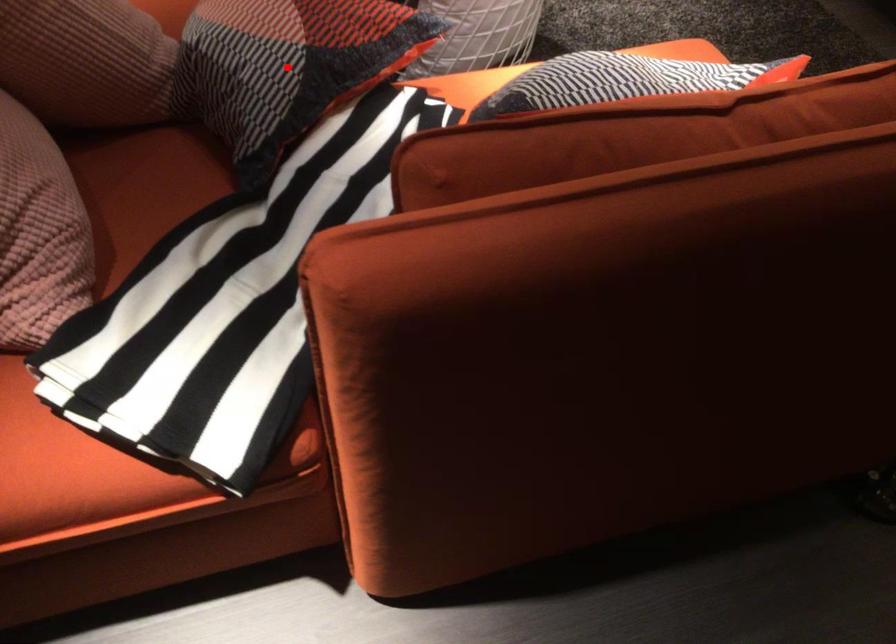
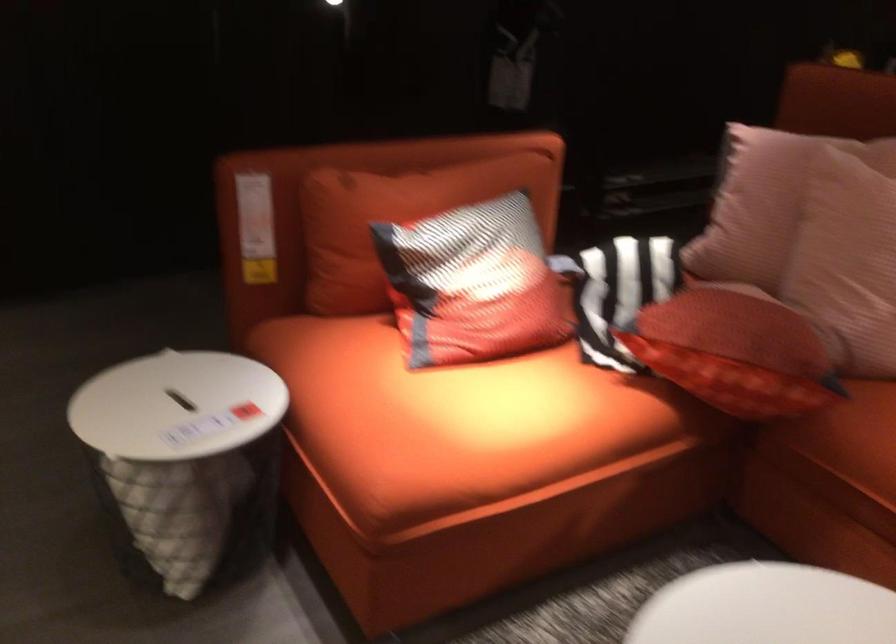
Question: I am providing you with two images of the same scene from different viewpoints. A red point is marked on the first image. Is the red point's position out of view in image 2?

Choices:
 (A) Yes
 (B) No

Answer: (A)